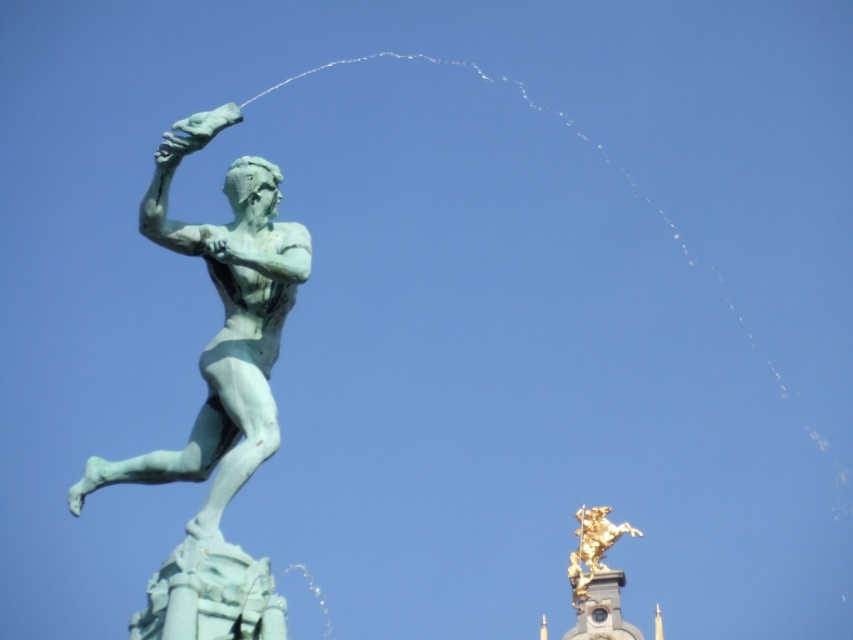
Question: Among these points, which one is nearest to the camera?

Choices:
 (A) (579, 509)
 (B) (254, 268)

Answer: (B)

Question: Can you confirm if green patina statue at left is smaller than gold metallic horse at upper right?

Choices:
 (A) no
 (B) yes

Answer: (A)

Question: Does green patina statue at left come behind gold metallic horse at upper right?

Choices:
 (A) yes
 (B) no

Answer: (B)

Question: Among these points, which one is nearest to the camera?

Choices:
 (A) (223, 424)
 (B) (596, 528)

Answer: (A)

Question: Does green patina statue at left appear on the right side of gold metallic horse at upper right?

Choices:
 (A) no
 (B) yes

Answer: (A)